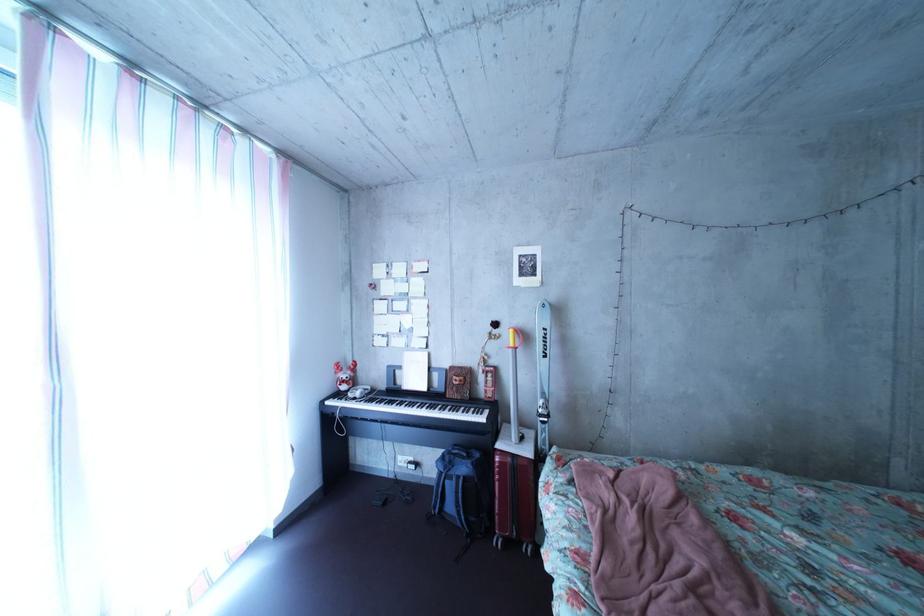
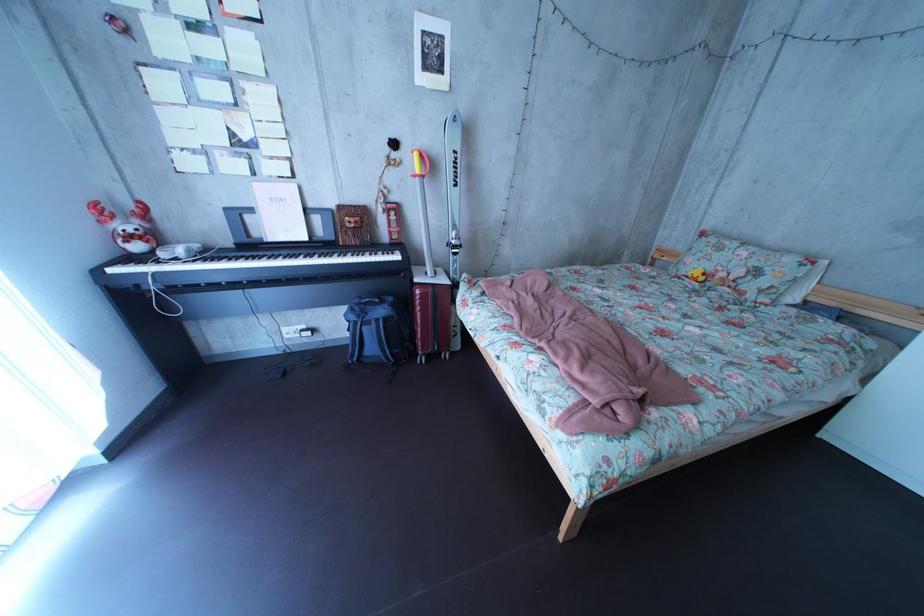
The images are taken continuously from a first-person perspective. In which direction is your viewpoint rotating?

The rotation direction of the camera is right-down.